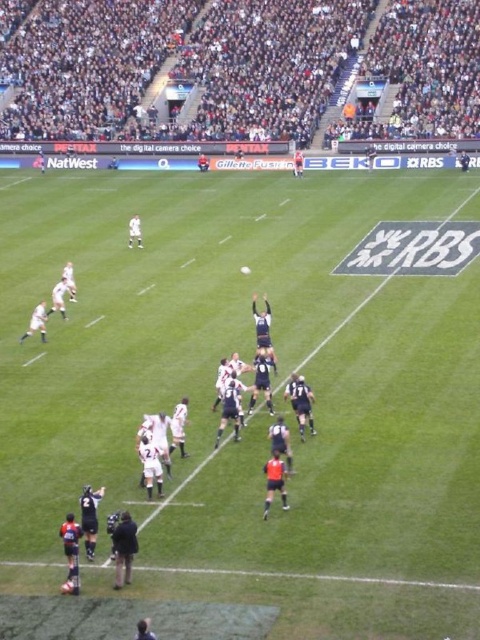
You are a photographer trying to capture the rugby match. You want to take a photo that includes both the green grass field at center and the dark gray stadium seats at upper center. Which object will appear narrower in the photo?

The green grass field at center will appear narrower in the photo because it is thinner than the dark gray stadium seats at upper center.

You are a spectator at the rugby match and want to take a photo of the black jersey at lower left without including the dark gray stadium seats at upper center in the frame. Based on their positions, is this possible?

The dark gray stadium seats at upper center is positioned on the left side of black jersey at lower left, so if you move to the right side of the black jersey at lower left, you can avoid including the dark gray stadium seats at upper center in your photo.

You are a spectator at the rugby match and want to take a photo of the black matte referee at lower left and the black jersey at lower left. Which one appears taller in the photo?

The black matte referee at lower left is taller than the black jersey at lower left, so the referee will appear taller in the photo.